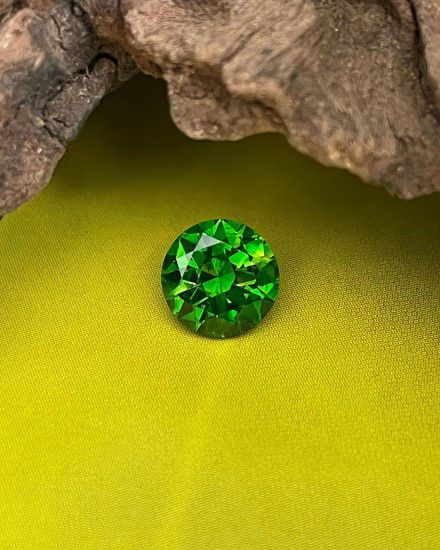
Locate an element on the screen. fabric is located at coordinates (364, 428).